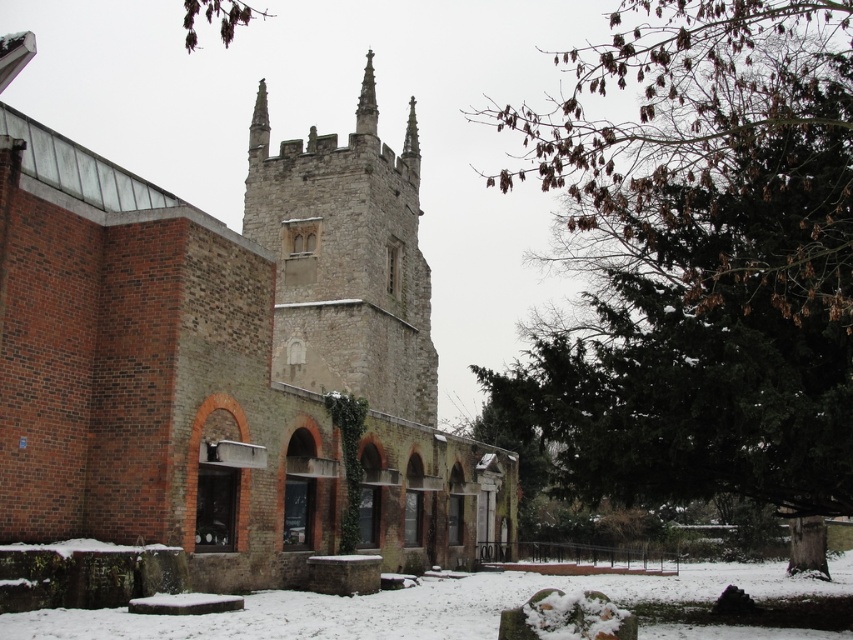
Can you confirm if brick church at center is shorter than gray stone tower at center?

No, brick church at center is not shorter than gray stone tower at center.

Between brick church at center and gray stone tower at center, which one is positioned higher?

gray stone tower at center

Between point (392, 561) and point (317, 356), which one is positioned behind?

The point (317, 356) is behind.

Find the location of `brick church at center`. brick church at center is located at coordinates (228, 362).

In the scene shown: Between brick church at center and smooth stone spire at center, which one appears on the right side from the viewer's perspective?

smooth stone spire at center is more to the right.

Between brick church at center and smooth stone spire at center, which one has more height?

brick church at center is taller.

Which is behind, point (119, 205) or point (369, 83)?

The point (369, 83) is more distant.

Find the location of a particular element. brick church at center is located at coordinates (228, 362).

Can you confirm if brick church at center is wider than white powdery snow at lower center?

No, brick church at center is not wider than white powdery snow at lower center.

Measure the distance between brick church at center and camera.

The distance of brick church at center from camera is 127.92 feet.

Locate an element on the screen. This screenshot has height=640, width=853. brick church at center is located at coordinates (228, 362).